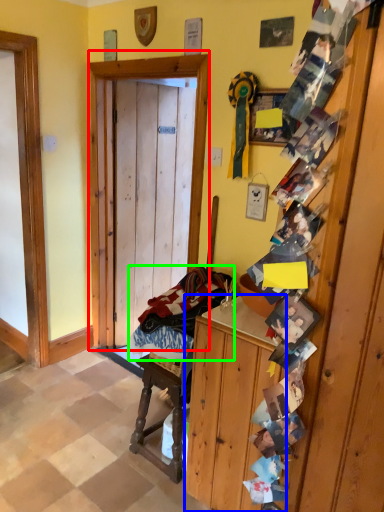
Question: Estimate the real-world distances between objects in this image. Which object is farther from door (highlighted by a red box), cabinetry (highlighted by a blue box) or laundry (highlighted by a green box)?

Choices:
 (A) cabinetry
 (B) laundry

Answer: (A)